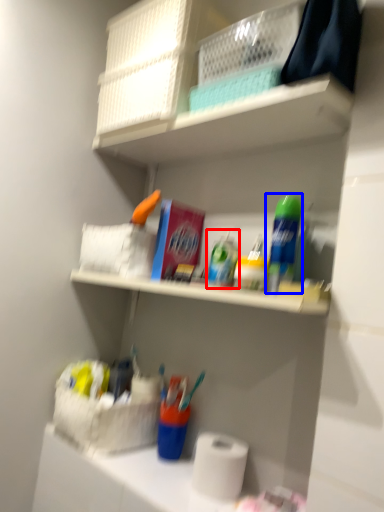
Question: Among these objects, which one is nearest to the camera, toiletry (highlighted by a red box) or cleaning product (highlighted by a blue box)?

Choices:
 (A) toiletry
 (B) cleaning product

Answer: (B)